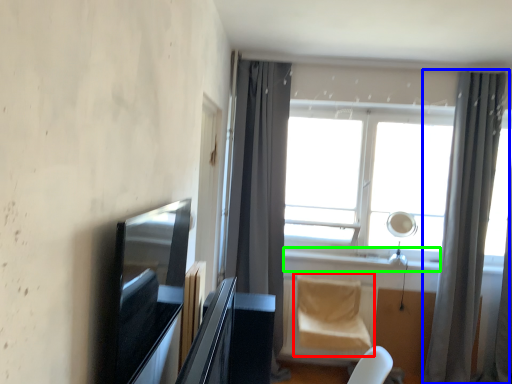
Question: Which object is positioned farthest from swivel chair (highlighted by a red box)? Select from curtain (highlighted by a blue box) and window sill (highlighted by a green box).

Choices:
 (A) curtain
 (B) window sill

Answer: (A)